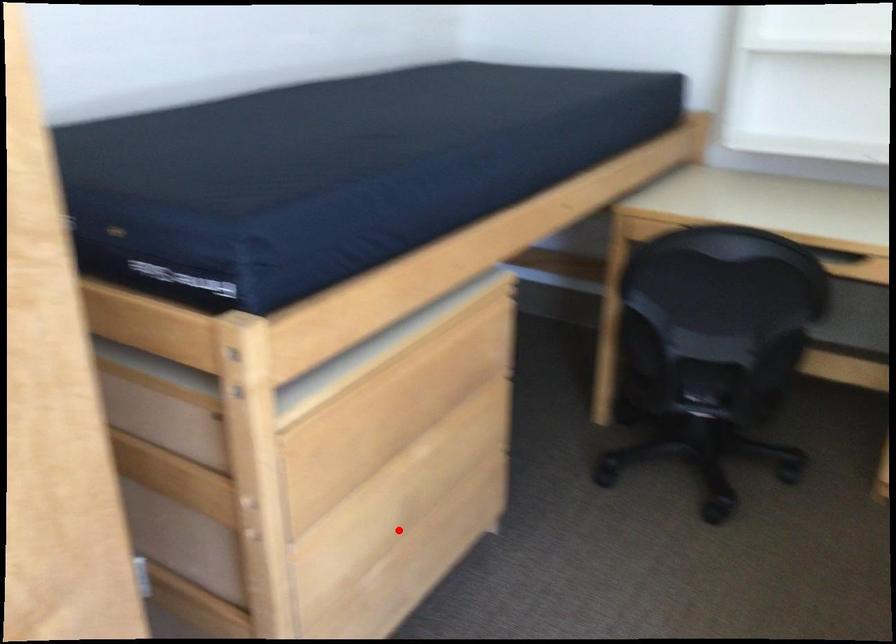
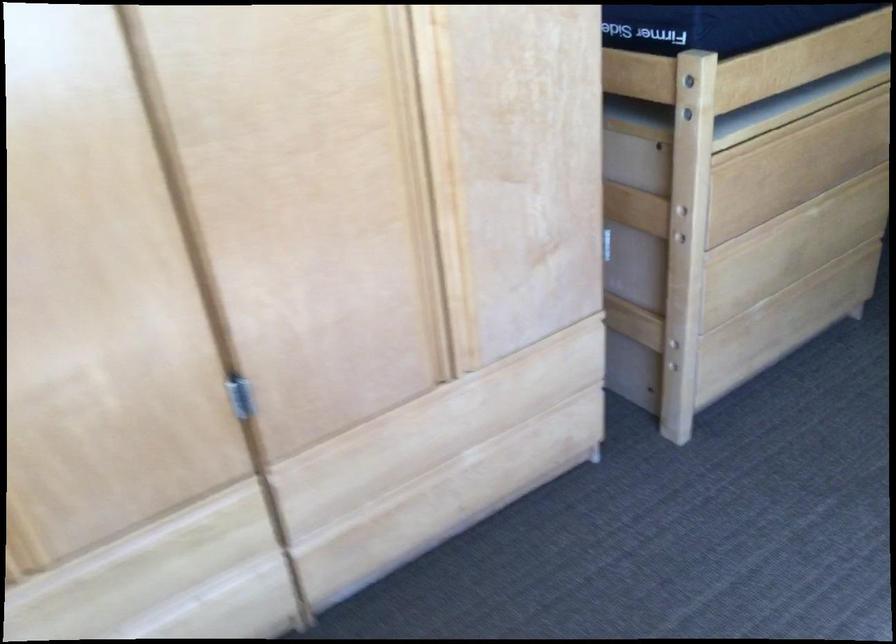
Where in the second image is the point corresponding to the highlighted location from the first image?

(778, 269)